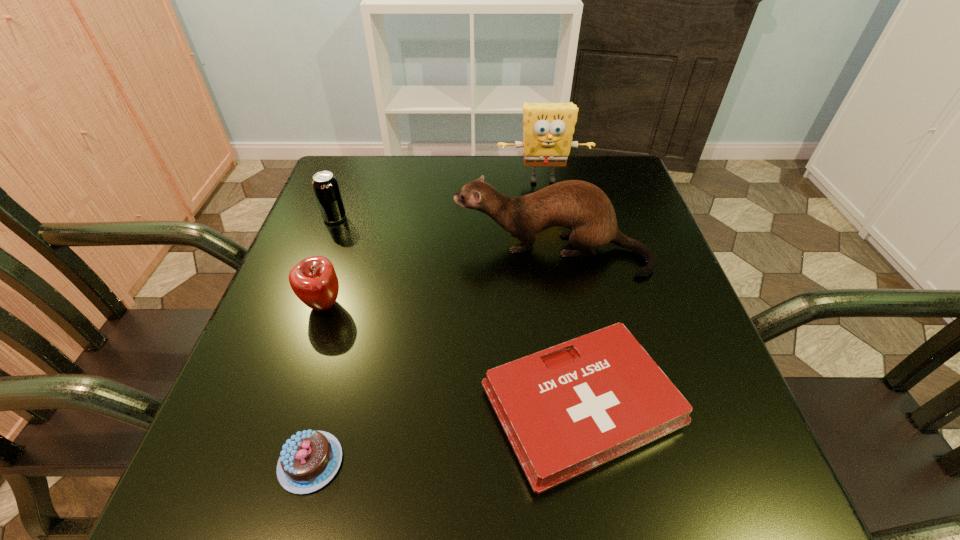
You are a GUI agent. You are given a task and a screenshot of the screen. Output one action in this format:
    pyautogui.click(x=<x>, y=<y>)
    Task: Click on the vacant position located at the face of the third farthest object
    
    Given the screenshot: What is the action you would take?
    pyautogui.click(x=390, y=252)

Image resolution: width=960 pixels, height=540 pixels. I want to click on vacant area located at the face of the third farthest object, so click(x=426, y=252).

Locate an element on the screen. This screenshot has width=960, height=540. free spot located 0.200m on the back of the second farthest object is located at coordinates (354, 167).

You are a GUI agent. You are given a task and a screenshot of the screen. Output one action in this format:
    pyautogui.click(x=<x>, y=<y>)
    Task: Click on the free spot located 0.280m on the right of the third nearest object
    Image resolution: width=960 pixels, height=540 pixels.
    Given the screenshot: What is the action you would take?
    pyautogui.click(x=489, y=305)

Identify the location of blank space located 0.070m on the back of the first-aid kit. (564, 308).

Find the location of a particular element. The height and width of the screenshot is (540, 960). vacant space located 0.190m on the back of the chocolate cake is located at coordinates (346, 333).

Find the location of a particular element. The height and width of the screenshot is (540, 960). object located in the far edge section of the desktop is located at coordinates (548, 129).

Image resolution: width=960 pixels, height=540 pixels. In order to click on the first-aid kit at the near edge in this screenshot , I will do `click(568, 409)`.

Identify the location of chocolate cake at the near edge. This screenshot has width=960, height=540. (310, 459).

This screenshot has width=960, height=540. I want to click on soda can that is positioned at the left edge, so click(325, 185).